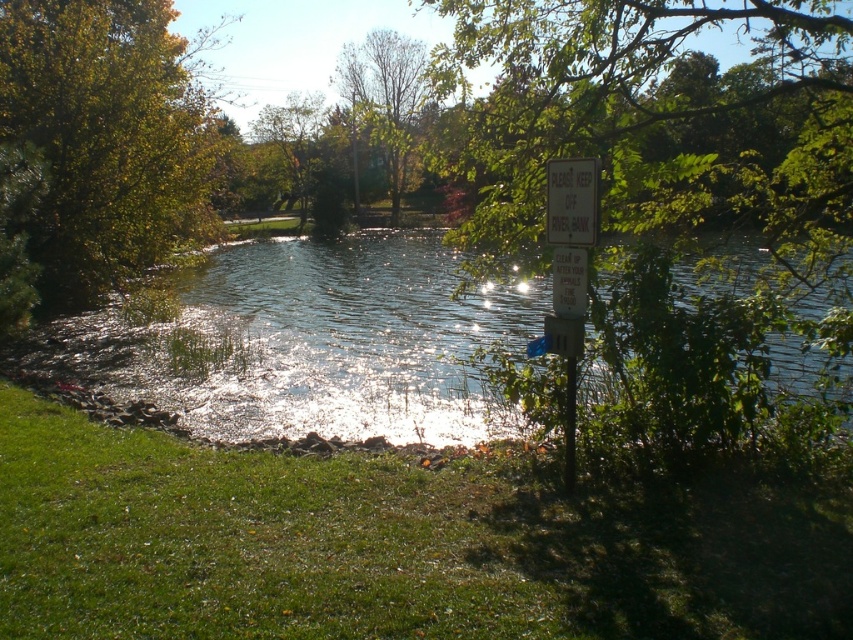
Question: Can you confirm if green leafy tree at left is positioned to the left of brown leafy tree at upper center?

Choices:
 (A) yes
 (B) no

Answer: (A)

Question: Can you confirm if green leafy tree at upper center is positioned to the right of white plastic sign at center-right?

Choices:
 (A) yes
 (B) no

Answer: (B)

Question: Which object is farther from the camera taking this photo?

Choices:
 (A) white paper sign at upper right
 (B) green grass at lower left
 (C) clear water at center
 (D) white plastic sign at center-right

Answer: (C)

Question: Which point is farther to the camera?

Choices:
 (A) green grass at lower left
 (B) white paper sign at upper right

Answer: (A)

Question: Which point is farther to the camera?

Choices:
 (A) (300, 166)
 (B) (402, 141)
 (C) (370, 365)

Answer: (A)

Question: Can you confirm if green leafy tree at left is positioned below green leafy tree at upper center?

Choices:
 (A) yes
 (B) no

Answer: (A)